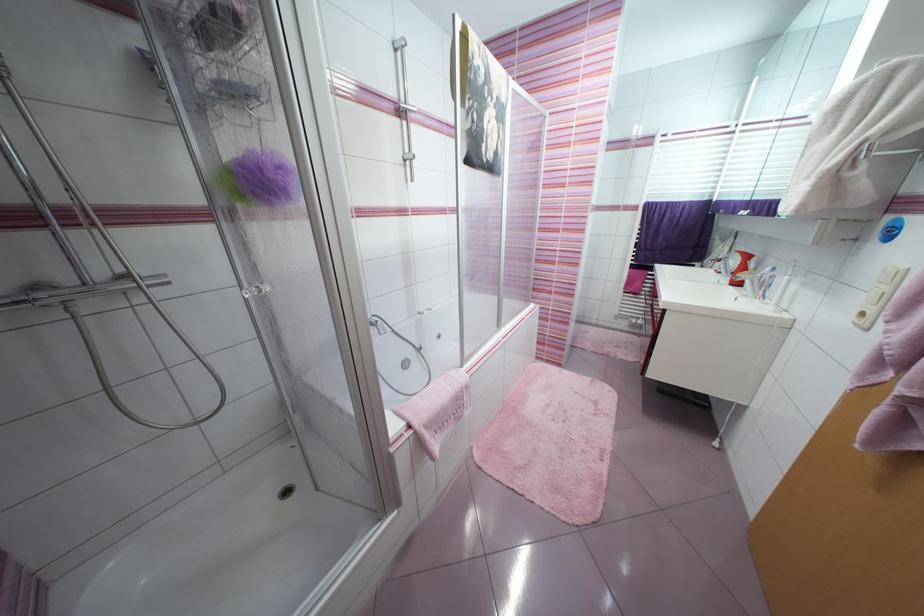
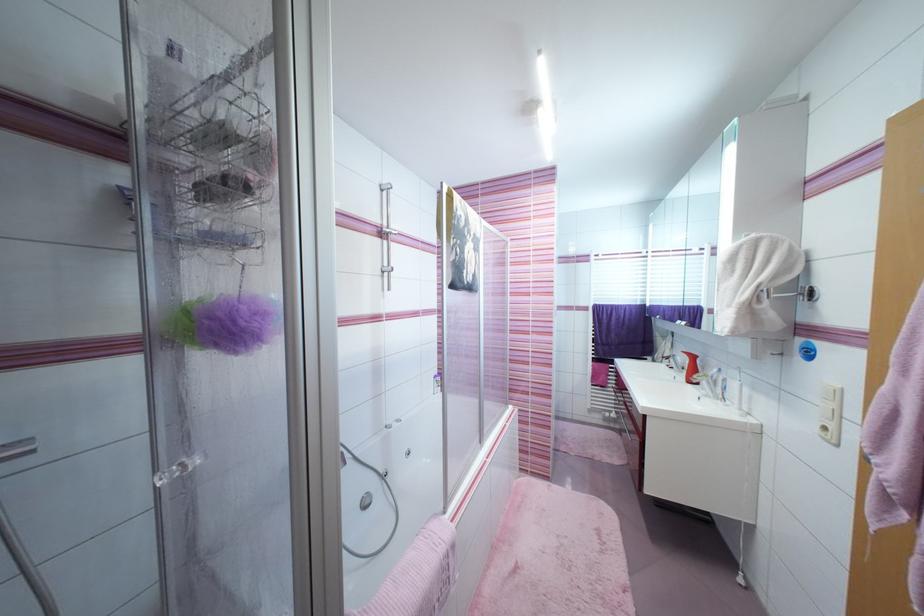
Where in the second image is the point corresponding to [868,378] from the first image?

(883, 517)